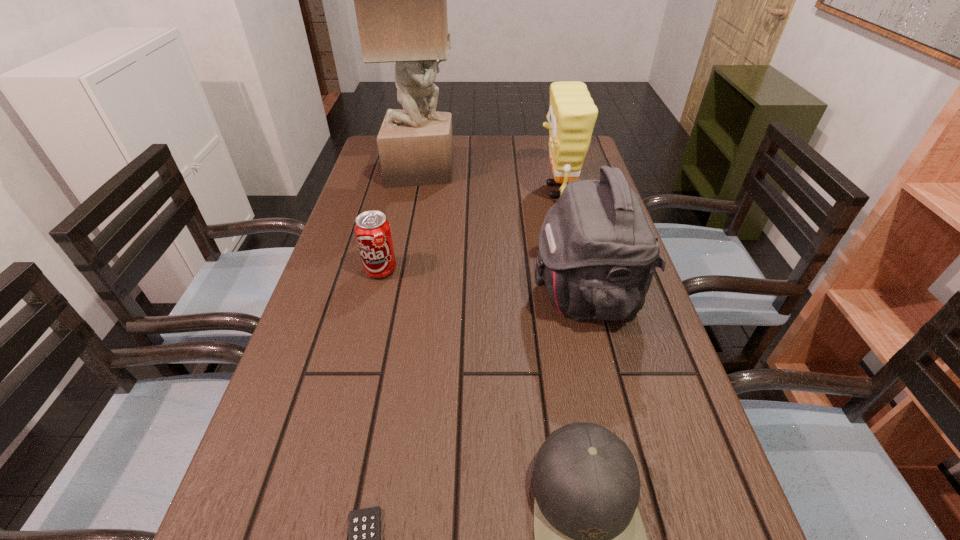
Identify the location of the tallest object. (400, 0).

Where is `sponge`? sponge is located at coordinates pyautogui.click(x=572, y=114).

The height and width of the screenshot is (540, 960). What are the coordinates of `shoulder bag` in the screenshot? It's located at (597, 253).

Image resolution: width=960 pixels, height=540 pixels. I want to click on the third shortest object, so click(x=373, y=233).

Find the location of a particular element. vacant space located on the front-facing side of the sculpture is located at coordinates (526, 171).

Identify the location of vacant space situated on the face of the sponge. The height and width of the screenshot is (540, 960). (406, 191).

At what (x,y) coordinates should I click in order to perform the action: click on vacant space located 0.180m on the face of the sponge. Please return your answer as a coordinate pair (x, y). This screenshot has width=960, height=540. Looking at the image, I should click on (475, 191).

The image size is (960, 540). I want to click on free location located 0.230m on the face of the sponge, so click(458, 191).

Where is `blank space located on the open flap of the shoulder bag`? blank space located on the open flap of the shoulder bag is located at coordinates pyautogui.click(x=389, y=293).

Where is `vacant space located 0.070m on the open flap of the shoulder bag`? vacant space located 0.070m on the open flap of the shoulder bag is located at coordinates (501, 293).